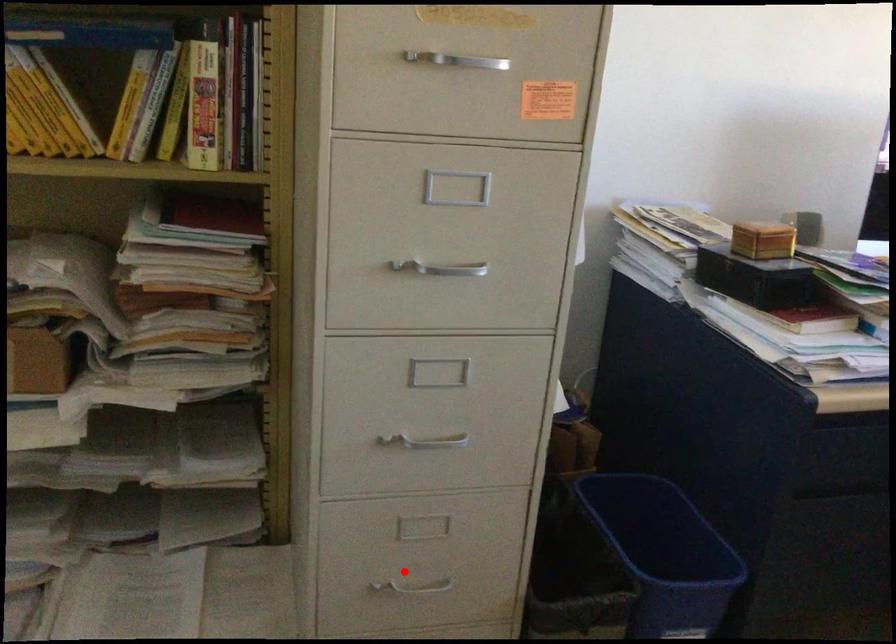
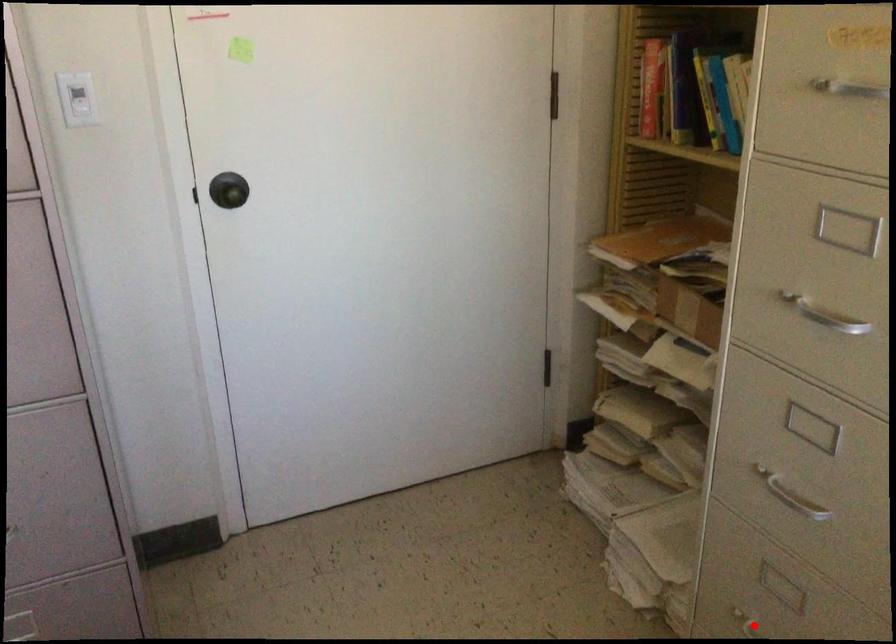
I am providing you with two images of the same scene from different viewpoints. A red point is marked on the first image and another point is marked on the second image. Does the point marked in image1 correspond to the same location as the one in image2?

Yes